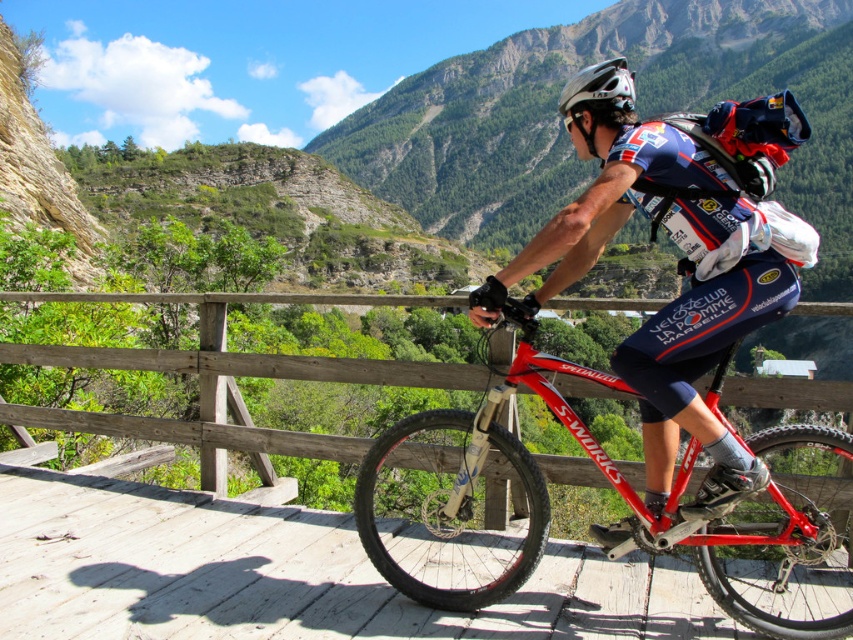
You are a photographer aiming to capture the cyclist and their equipment. You notice the shiny red frame at center and the white matte helmet at upper center. Which object should you focus on first if you want to photograph the cyclist from a perspective where the helmet is partially hidden by the bike?

You should focus on the shiny red frame at center first because it is in front of the white matte helmet at upper center, so the helmet will be partially hidden by the bike frame when viewed from that angle.

You are a delivery drone operator. Your drone is currently positioned at the red matte bicycle at center. You need to deliver a package to the white matte helmet at upper center. The drone has a maximum flight range of 15 feet. Can the drone reach the destination without needing to recharge?

The distance between the red matte bicycle at center and the white matte helmet at upper center is 13.67 feet, which is within the drone operator maximum flight range of 15 feet. The drone can reach the destination without needing to recharge.

You are a photographer positioned on the wooden bridge. You want to take a photo of the cyclist so that the red matte bicycle at center is clearly visible in the foreground while still showing the white matte helmet at upper center in the background. Is this arrangement possible given their positions?

The red matte bicycle at center is in front of the white matte helmet at upper center, so positioning the camera to focus on the bicycle will naturally place it in the foreground with the helmet visible in the background. This arrangement is achievable as described.